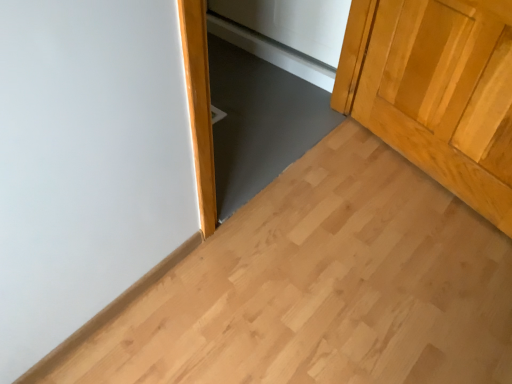
Where is `unoccupied area in front of light brown wood door at right`? The height and width of the screenshot is (384, 512). unoccupied area in front of light brown wood door at right is located at coordinates (410, 244).